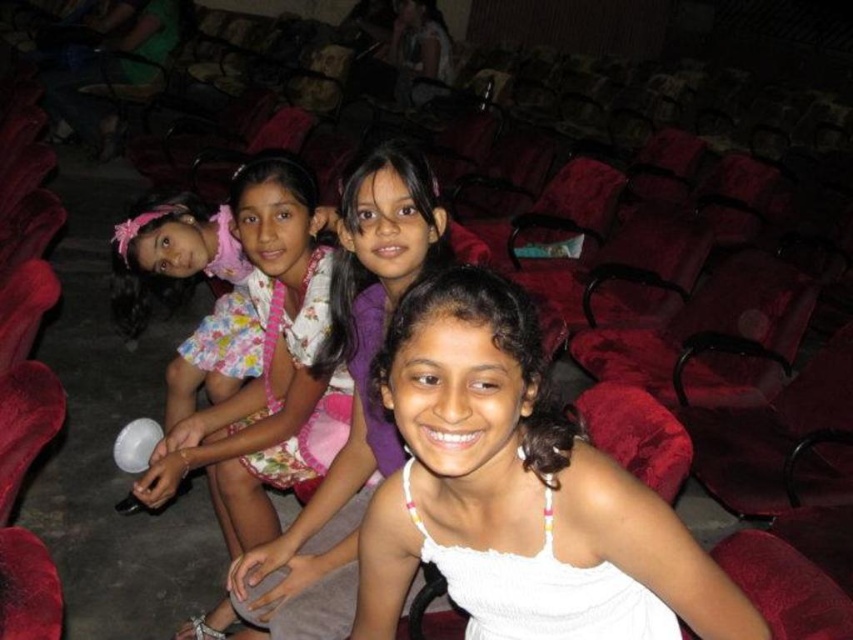
Which is above, floral fabric dress at center or white cotton dress at center?

white cotton dress at center is higher up.

Does floral fabric dress at center come behind white cotton dress at center?

Yes, it is.

Is point (282, 410) more distant than point (277, 541)?

That is True.

You are a GUI agent. You are given a task and a screenshot of the screen. Output one action in this format:
    pyautogui.click(x=<x>, y=<y>)
    Task: Click on the floral fabric dress at center
    This screenshot has height=640, width=853.
    Given the screenshot: What is the action you would take?
    pyautogui.click(x=265, y=365)

Can you confirm if white fabric dress at center is taller than floral fabric dress at center?

No.

Consider the image. Can you confirm if white fabric dress at center is bigger than floral fabric dress at center?

Incorrect, white fabric dress at center is not larger than floral fabric dress at center.

Locate an element on the screen. The image size is (853, 640). white fabric dress at center is located at coordinates (514, 472).

Does white cotton dress at center have a greater width compared to smooth skin woman at upper center?

No, white cotton dress at center is not wider than smooth skin woman at upper center.

Is white cotton dress at center below smooth skin woman at upper center?

Correct, white cotton dress at center is located below smooth skin woman at upper center.

Looking at this image, measure the distance between white cotton dress at center and camera.

white cotton dress at center and camera are 1.39 meters apart.

This screenshot has height=640, width=853. What are the coordinates of `white cotton dress at center` in the screenshot? It's located at (352, 397).